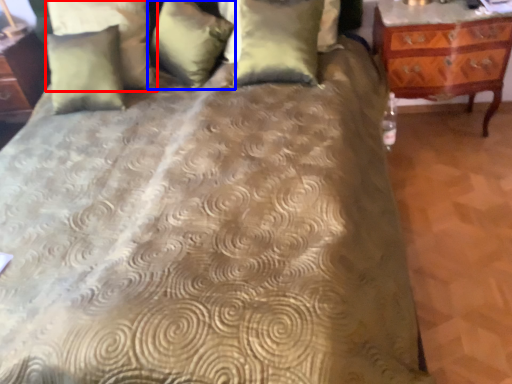
Question: Among these objects, which one is nearest to the camera, pillow (highlighted by a red box) or pillow (highlighted by a blue box)?

Choices:
 (A) pillow
 (B) pillow

Answer: (B)